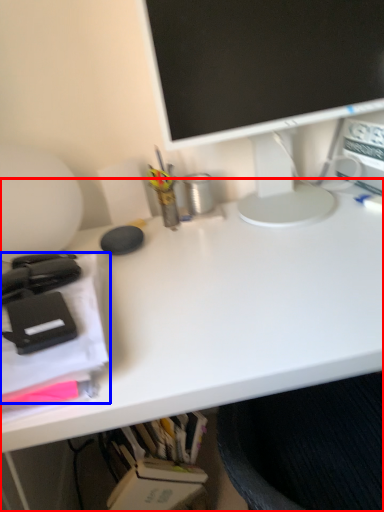
Question: Which point is further to the camera, desk (highlighted by a red box) or office supplies (highlighted by a blue box)?

Choices:
 (A) desk
 (B) office supplies

Answer: (A)